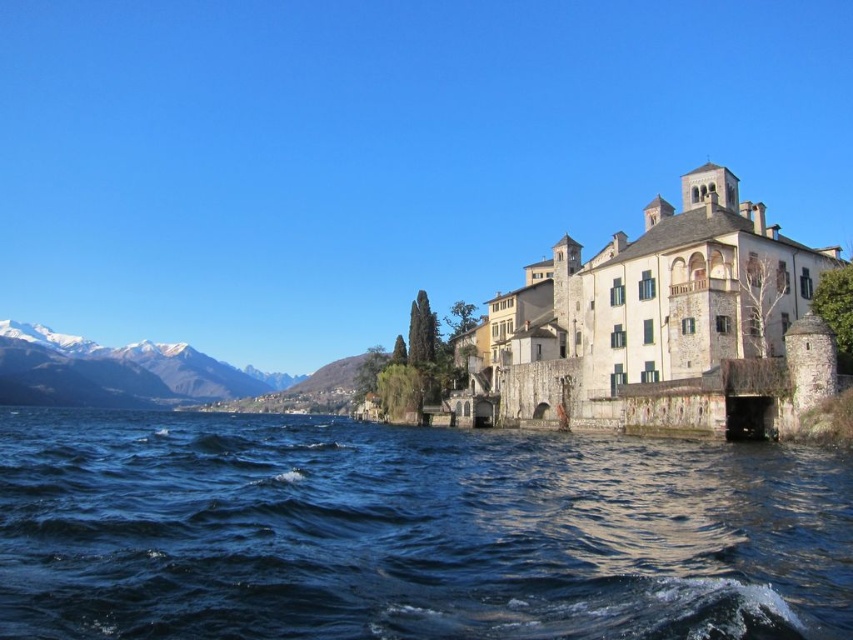
Question: Can you confirm if dark blue water at lower left is positioned to the right of snowy white mountain at left?

Choices:
 (A) no
 (B) yes

Answer: (B)

Question: Which point is farther to the camera?

Choices:
 (A) dark blue water at lower left
 (B) snowy white mountain at left

Answer: (B)

Question: Which point is farther to the camera?

Choices:
 (A) (90, 582)
 (B) (190, 400)

Answer: (B)

Question: Is dark blue water at lower left further to camera compared to snowy white mountain at left?

Choices:
 (A) no
 (B) yes

Answer: (A)

Question: Does dark blue water at lower left have a greater width compared to snowy white mountain at left?

Choices:
 (A) yes
 (B) no

Answer: (B)